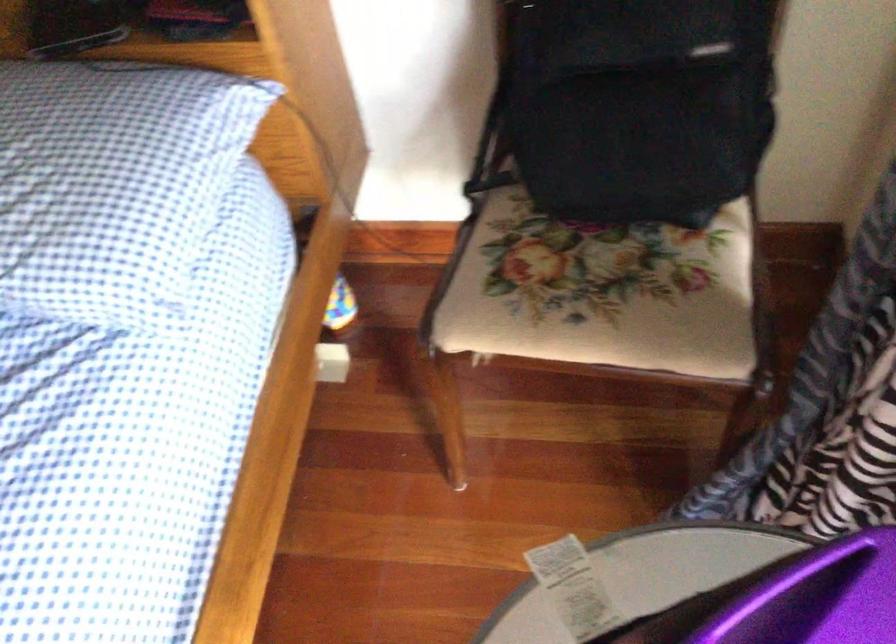
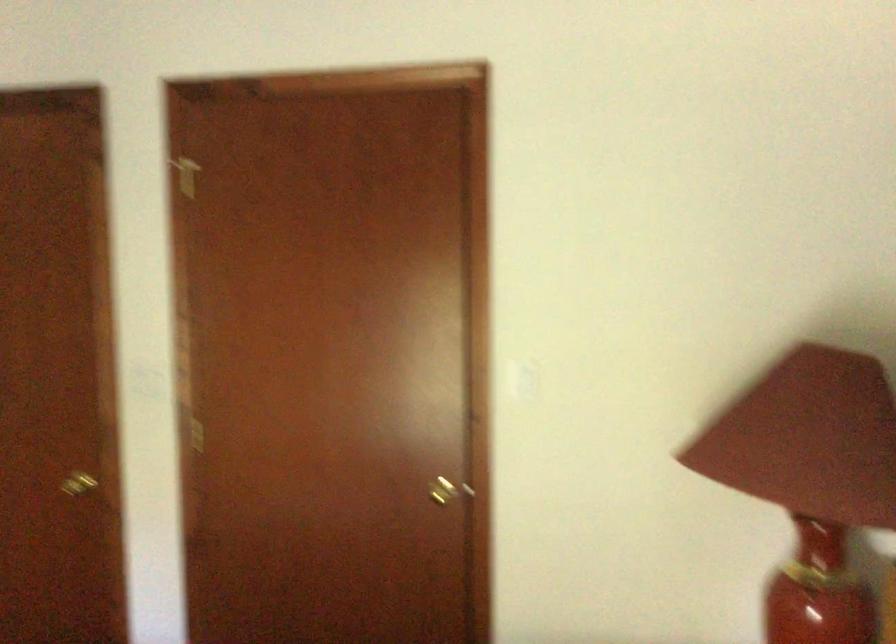
Question: Based on the continuous images, in which direction is the camera rotating? Reply with the corresponding letter.

Choices:
 (A) Left
 (B) Right
 (C) Up
 (D) Down

Answer: (A)